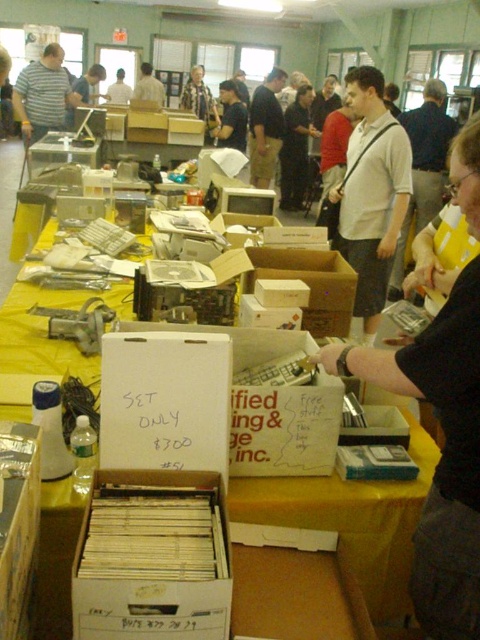
Is point (10, 540) behind point (242, 115)?

No, it is not.

Who is more forward, (x=8, y=627) or (x=242, y=150)?

Positioned in front is point (x=8, y=627).

The width and height of the screenshot is (480, 640). What are the coordinates of `yellow cardboard box at lower left` in the screenshot? It's located at (17, 524).

Who is positioned more to the right, yellow fabric table at center or matte black shirt at center?

matte black shirt at center

Does yellow fabric table at center appear on the left side of matte black shirt at center?

Correct, you'll find yellow fabric table at center to the left of matte black shirt at center.

Does point (349, 532) come behind point (225, 109)?

No, (349, 532) is in front of (225, 109).

At what (x,y) coordinates should I click in order to perform the action: click on yellow fabric table at center. Please return your answer as a coordinate pair (x, y). Looking at the image, I should click on (351, 520).

Between yellow fabric table at center and brown cardboard box at center, which one appears on the right side from the viewer's perspective?

brown cardboard box at center

The image size is (480, 640). What are the coordinates of `yellow fabric table at center` in the screenshot? It's located at (351, 520).

Where is `yellow fabric table at center`? yellow fabric table at center is located at coordinates (351, 520).